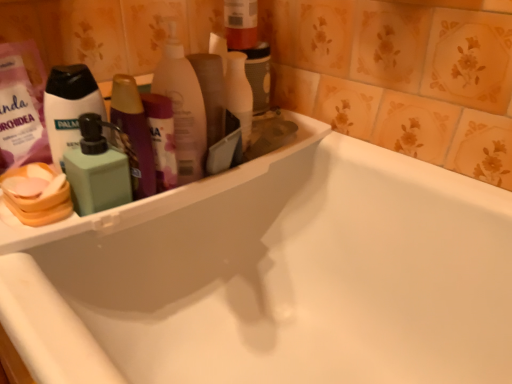
Locate an element on the screen. This screenshot has height=384, width=512. free location in front of green matte soap dispenser at left, which ranks as the 1th cleaning product in left-to-right order is located at coordinates (49, 238).